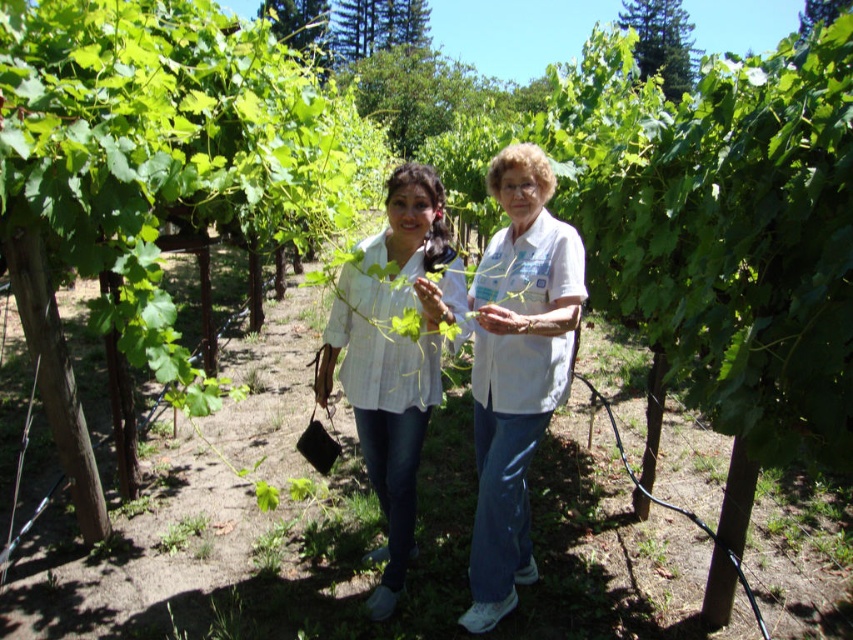
You are standing in the vineyard and see two points marked in the image. Which point is closer to you, point (567, 225) or point (424, 368)?

Point (567, 225) is further to the viewer than point (424, 368), so point (424, 368) is closer to you.

You are a photographer standing at the entrance of the vineyard. You want to take a photo of the white cotton shirt at center. Where should you position yourself to capture it in the frame?

The white cotton shirt at center is located at coordinates point [515,369], so you should position yourself facing the center of the vineyard to capture it in the frame.